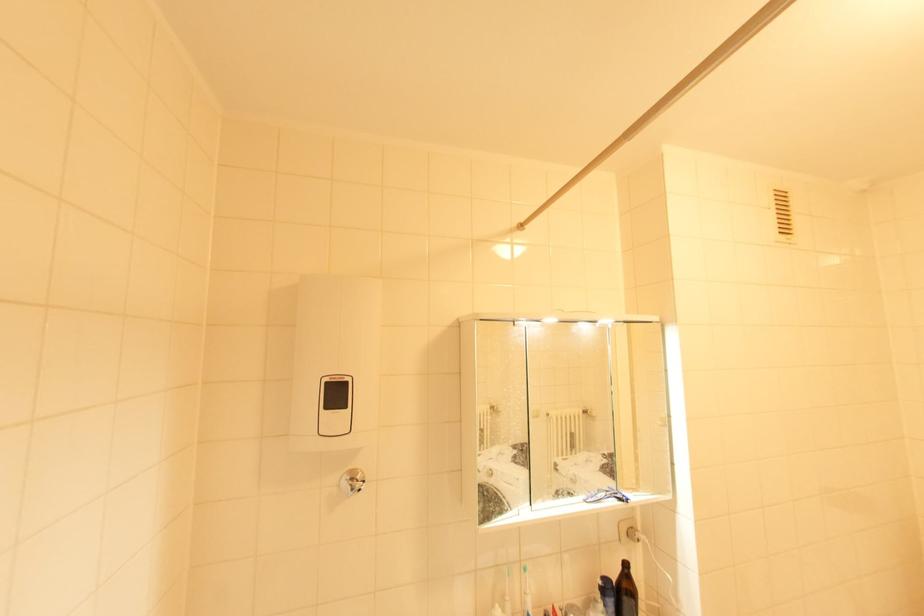
You are a GUI agent. You are given a task and a screenshot of the screen. Output one action in this format:
    pyautogui.click(x=<x>, y=<y>)
    Task: Click on the white toothbrush
    
    Given the screenshot: What is the action you would take?
    pyautogui.click(x=526, y=591)